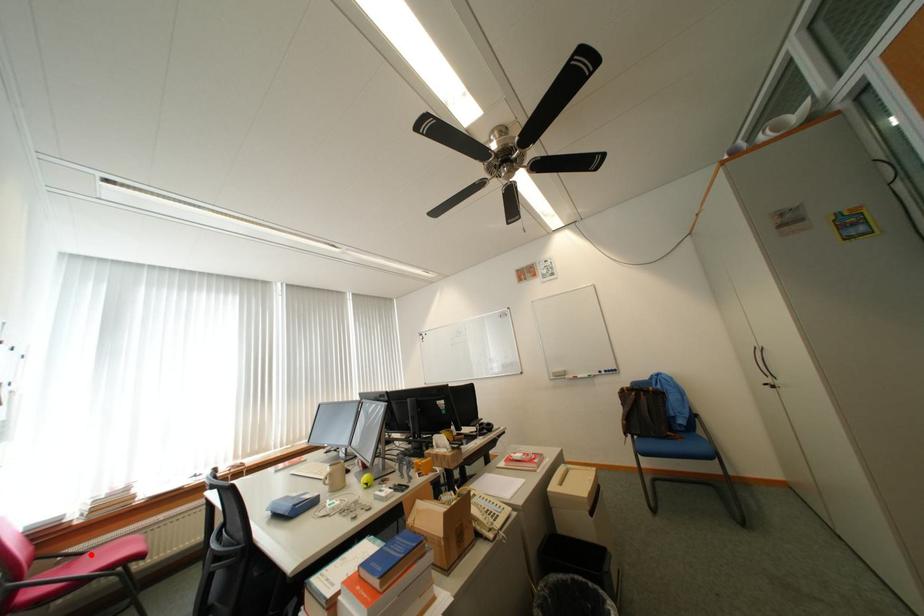
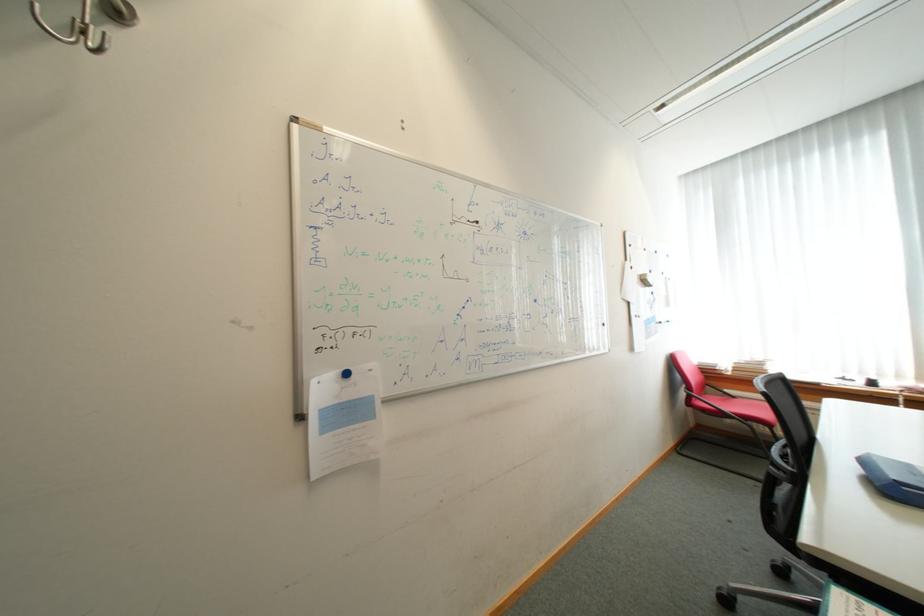
Find the pixel in the second image that matches the highlighted location in the first image.

(743, 398)